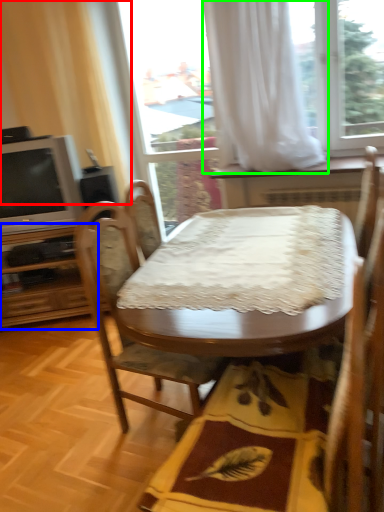
Question: Which is farther away from curtain (highlighted by a red box)? dresser (highlighted by a blue box) or curtain (highlighted by a green box)?

Choices:
 (A) dresser
 (B) curtain

Answer: (B)